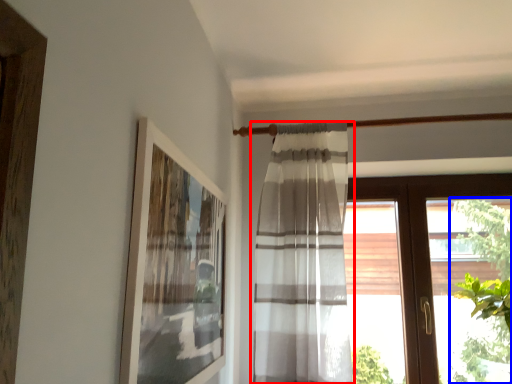
Question: Which of the following is the closest to the observer, curtain (highlighted by a red box) or plant (highlighted by a blue box)?

Choices:
 (A) curtain
 (B) plant

Answer: (B)